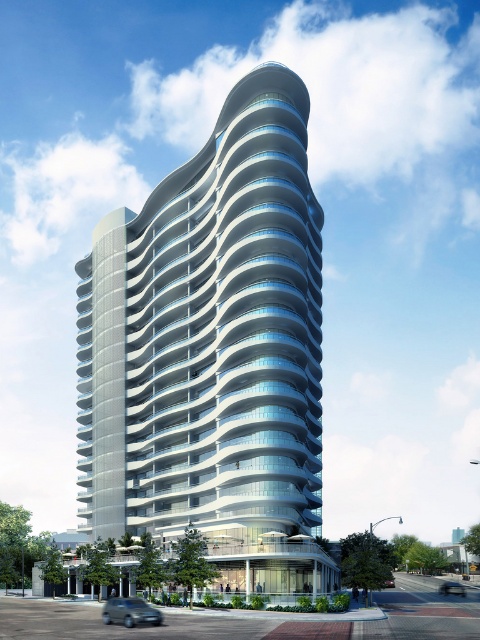
Question: Is white glass building at center wider than silver metallic car at lower right?

Choices:
 (A) no
 (B) yes

Answer: (B)

Question: Which object appears farthest from the camera in this image?

Choices:
 (A) silver metallic car at lower right
 (B) white glass building at center
 (C) metallic silver car at lower center

Answer: (A)

Question: Does silver metallic car at lower left appear on the left side of silver metallic car at lower right?

Choices:
 (A) yes
 (B) no

Answer: (A)

Question: Does white glass building at center appear over silver metallic car at lower left?

Choices:
 (A) yes
 (B) no

Answer: (A)

Question: Which point is closer to the camera?

Choices:
 (A) white glass building at center
 (B) silver metallic car at lower right

Answer: (A)

Question: Which point is farther from the camera taking this photo?

Choices:
 (A) (143, 612)
 (B) (385, 586)
 (C) (446, 586)
 (D) (321, 547)

Answer: (C)